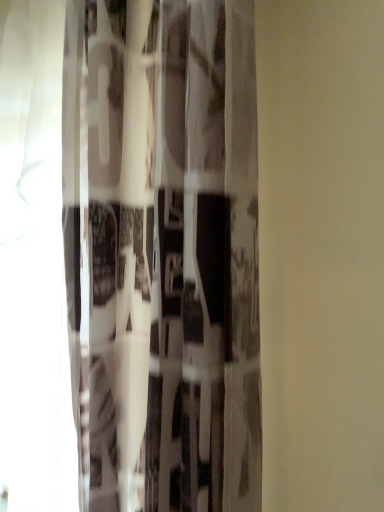
At what (x,y) coordinates should I click in order to perform the action: click on translucent fabric at center. Please return your answer as a coordinate pair (x, y). Looking at the image, I should click on (163, 253).

The height and width of the screenshot is (512, 384). Describe the element at coordinates (163, 253) in the screenshot. I see `translucent fabric at center` at that location.

Measure the distance between point [111,116] and camera.

Point [111,116] is 26.97 inches from camera.

The width and height of the screenshot is (384, 512). Find the location of `translucent fabric at center`. translucent fabric at center is located at coordinates (163, 253).